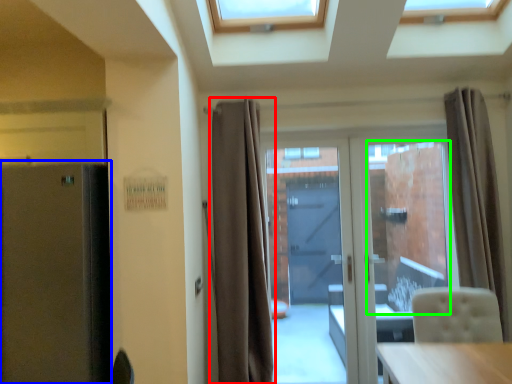
Question: Which object is the closest to the curtain (highlighted by a red box)? Choose among these: fridge (highlighted by a blue box) or window screen (highlighted by a green box).

Choices:
 (A) fridge
 (B) window screen

Answer: (A)